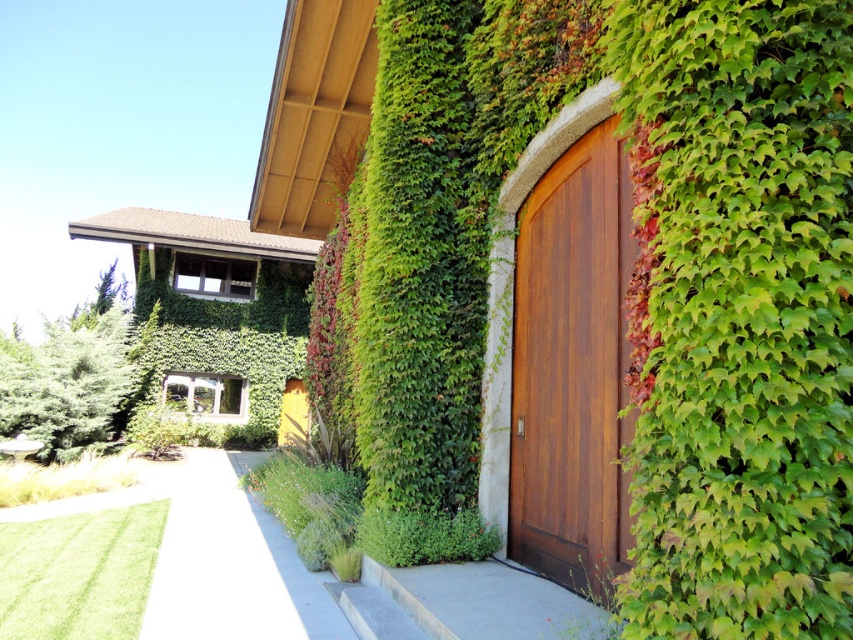
Question: In this image, where is shiny brown wood door at center located relative to white concrete path at lower center?

Choices:
 (A) right
 (B) left

Answer: (A)

Question: Which object is closer to the camera taking this photo?

Choices:
 (A) yellow matte door at center
 (B) white concrete path at lower center

Answer: (B)

Question: Which object is the farthest from the shiny brown wood door at center?

Choices:
 (A) white concrete path at lower center
 (B) yellow matte door at center

Answer: (B)

Question: Is white concrete path at lower center positioned before yellow matte door at center?

Choices:
 (A) yes
 (B) no

Answer: (A)

Question: Is shiny brown wood door at center wider than white concrete path at lower center?

Choices:
 (A) yes
 (B) no

Answer: (B)

Question: Which point appears closest to the camera in this image?

Choices:
 (A) (306, 428)
 (B) (604, 291)
 (C) (309, 636)

Answer: (C)